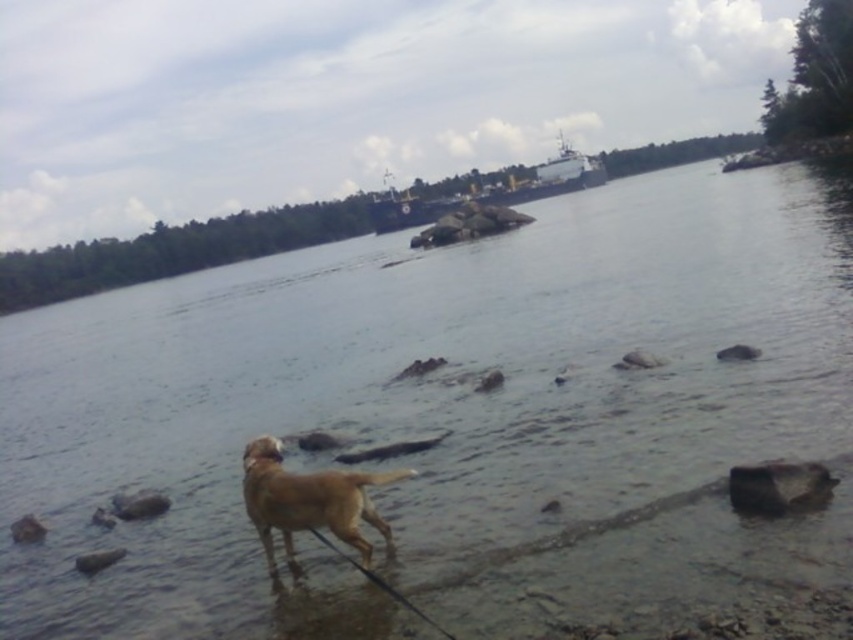
You are a photographer trying to capture the golden fur dog at lower center and the gray smooth rock at lower right in the same frame. Based on their sizes, which object would appear bigger in your photo?

The golden fur dog at lower center would appear bigger in the photo since it is larger in size than the gray smooth rock at lower right.

You are a photographer trying to capture the golden fur dog at lower center and the gray rock at lower left in the same frame. Based on their positions, can you determine which object is closer to the camera?

The golden fur dog at lower center is above the gray rock at lower left, so the gray rock at lower left is closer to the camera than the golden fur dog at lower center.

You are a photographer trying to capture the golden fur dog at lower center. You notice a point marked at coordinates point (308, 499). Where should you aim your camera to ensure the dog is centered in your shot?

The point (308, 499) corresponds to the golden fur dog at lower center, so aim your camera at that coordinate to center the dog in your shot.